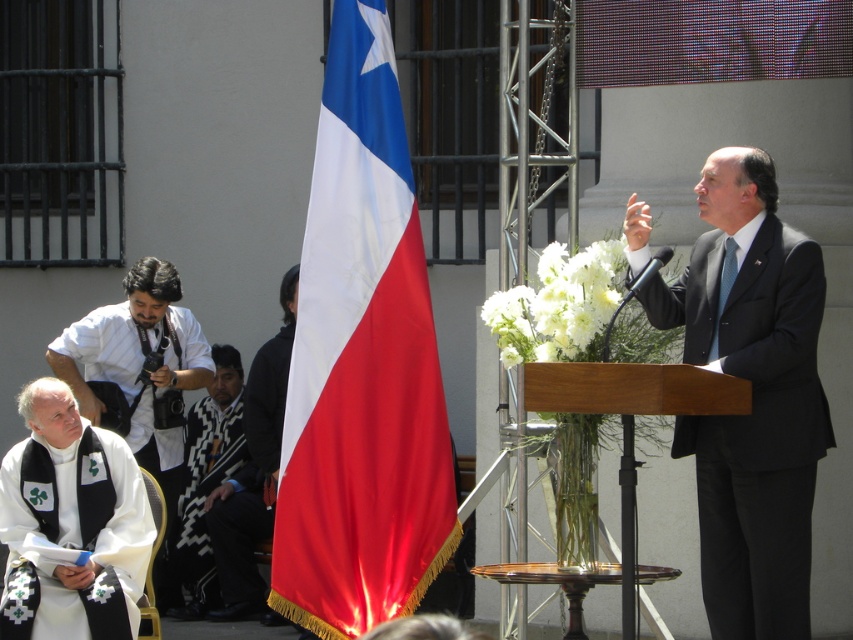
You are standing at the center of the image and want to move towards the point marked at coordinates (73, 536). Which direction should you go?

→ The point at coordinates (73, 536) is located on the white matte robe at lower left, so you should move towards the lower left direction to reach it.

You are organizing a small event and need to place a 1.2 meter wide table between the matte black robe at right and the white fabric shirt at left. Will there be enough space for the table?

The distance between the matte black robe at right and the white fabric shirt at left is 8.52 meters, which is more than enough to accommodate a 1.2 meter wide table between them.

You are organizing a photo shoot and need to know the relative sizes of the matte black robe at right and the white fabric shirt at left. Which one is smaller?

The matte black robe at right has a smaller size compared to the white fabric shirt at left, so the matte black robe at right is smaller.